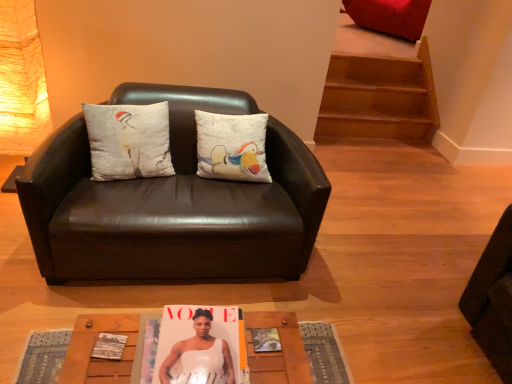
The height and width of the screenshot is (384, 512). Identify the location of unoccupied region to the right of black leather couch at center. (373, 270).